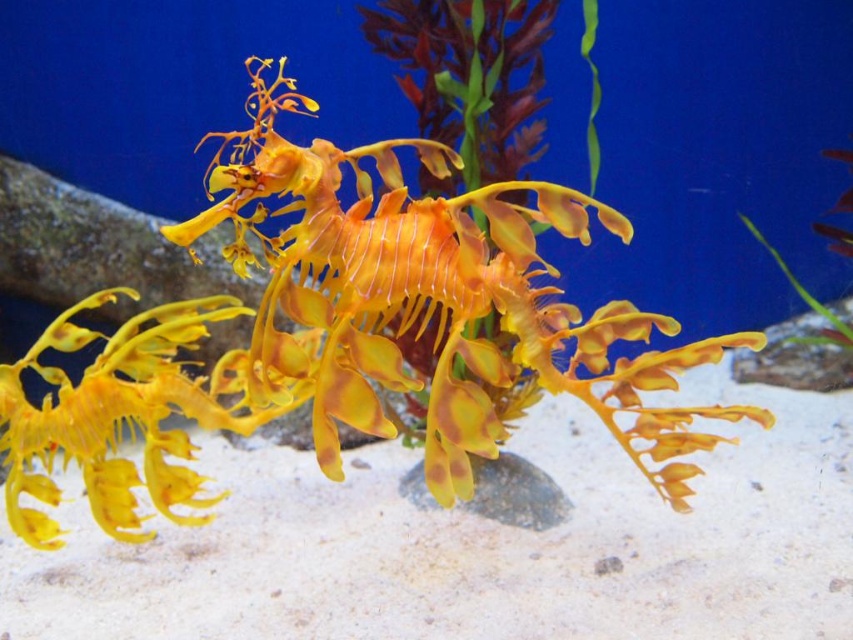
Can you confirm if yellow matte seahorse at center is bigger than green leafy plant at center?

Yes.

Is yellow matte seahorse at center shorter than green leafy plant at center?

No, yellow matte seahorse at center is not shorter than green leafy plant at center.

The image size is (853, 640). I want to click on yellow matte seahorse at center, so click(x=345, y=333).